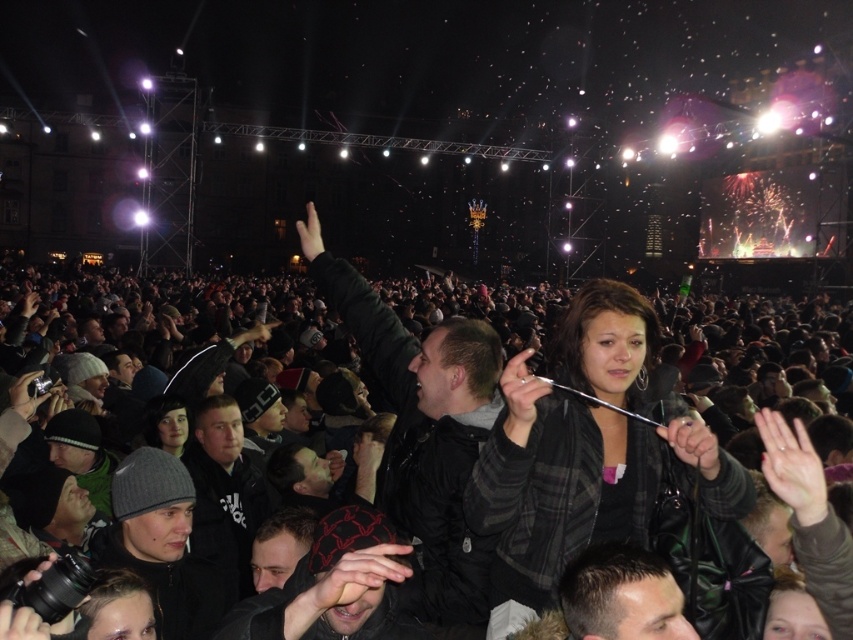
Question: In this image, where is black leather jacket at center located relative to plaid fabric jacket at center?

Choices:
 (A) above
 (B) below

Answer: (A)

Question: Can you confirm if black leather jacket at center is bigger than plaid fabric jacket at center?

Choices:
 (A) no
 (B) yes

Answer: (B)

Question: Is black leather jacket at center positioned at the back of plaid fabric jacket at center?

Choices:
 (A) no
 (B) yes

Answer: (A)

Question: Among these points, which one is nearest to the camera?

Choices:
 (A) (508, 586)
 (B) (825, 339)

Answer: (A)